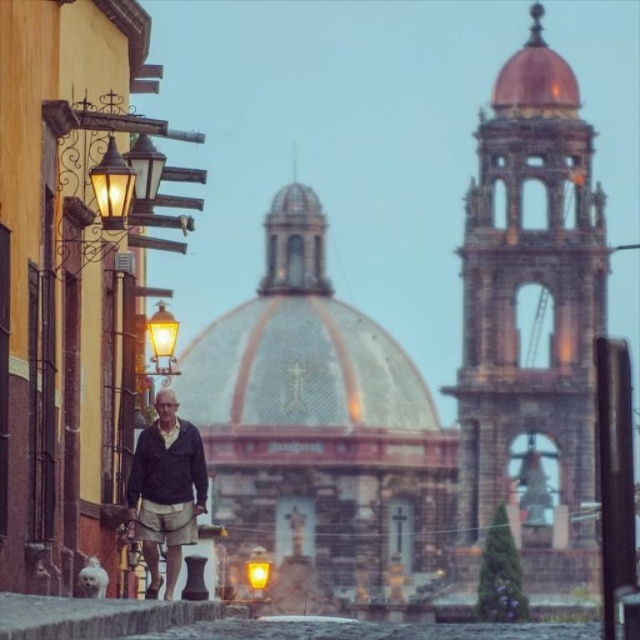
Is dark gray jacket at center closer to camera compared to beige cotton kilt at lower center?

Yes, it is in front of beige cotton kilt at lower center.

Who is more forward, (173, 506) or (141, 515)?

Point (141, 515) is more forward.

Where is `dark gray jacket at center`? dark gray jacket at center is located at coordinates (166, 490).

Who is shorter, beige cotton kilt at lower center or matte gold streetlamp at left?

beige cotton kilt at lower center

Does beige cotton kilt at lower center have a greater height compared to matte gold streetlamp at left?

No.

Find the location of a particular element. Image resolution: width=640 pixels, height=640 pixels. beige cotton kilt at lower center is located at coordinates (166, 524).

Which of these two, dark gray jacket at center or matte gold streetlamp at left, stands shorter?

matte gold streetlamp at left

You are a GUI agent. You are given a task and a screenshot of the screen. Output one action in this format:
    pyautogui.click(x=<x>, y=<y>)
    Task: Click on the dark gray jacket at center
    This screenshot has width=640, height=640.
    Given the screenshot: What is the action you would take?
    pyautogui.click(x=166, y=490)

In order to click on dark gray jacket at center in this screenshot , I will do `click(166, 490)`.